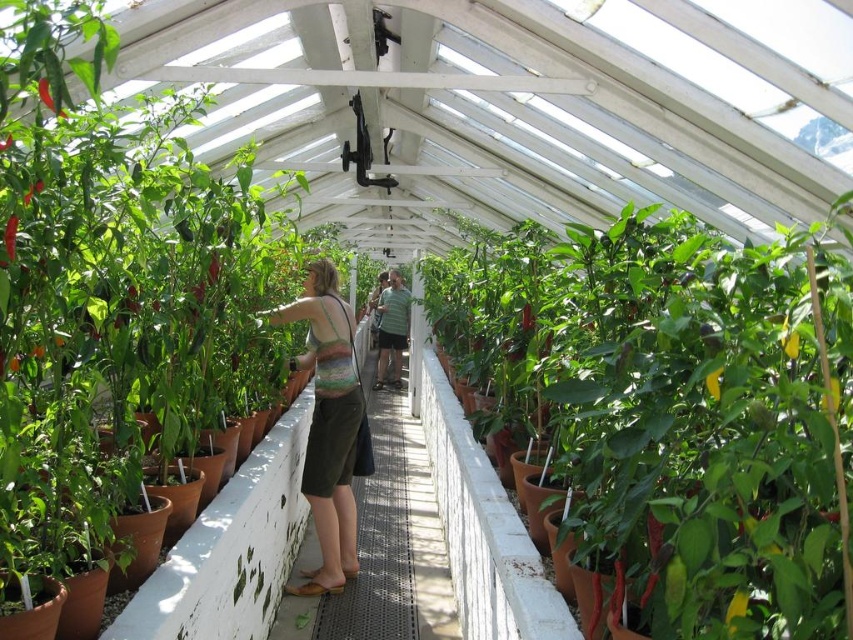
Is point (711, 248) farther from viewer compared to point (387, 355)?

No.

Does green matte pot at center have a greater height compared to green striped shirt at center?

No, green matte pot at center is not taller than green striped shirt at center.

Locate an element on the screen. green matte pot at center is located at coordinates (671, 406).

Is point (820, 476) positioned after point (334, 408)?

No, it is not.

Measure the distance between green matte pot at center and camera.

green matte pot at center and camera are 36.97 inches apart from each other.

Image resolution: width=853 pixels, height=640 pixels. In order to click on green matte pot at center in this screenshot , I will do `click(671, 406)`.

Between point (329, 544) and point (393, 378), which one is positioned behind?

Positioned behind is point (393, 378).

Who is higher up, multicolored knitted tank top at center or green striped shirt at center?

Positioned higher is green striped shirt at center.

Where is `multicolored knitted tank top at center`? Image resolution: width=853 pixels, height=640 pixels. multicolored knitted tank top at center is located at coordinates (328, 422).